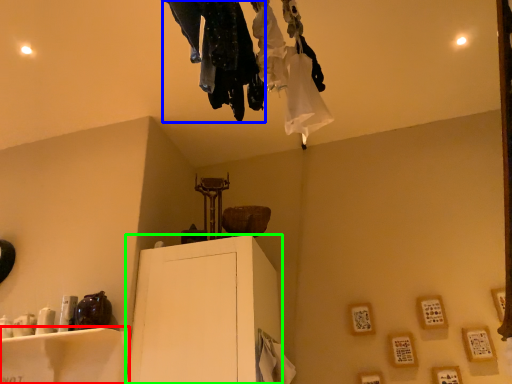
Question: Based on their relative distances, which object is nearer to furniture (highlighted by a red box)? Choose from clothing (highlighted by a blue box) and furniture (highlighted by a green box).

Choices:
 (A) clothing
 (B) furniture

Answer: (B)